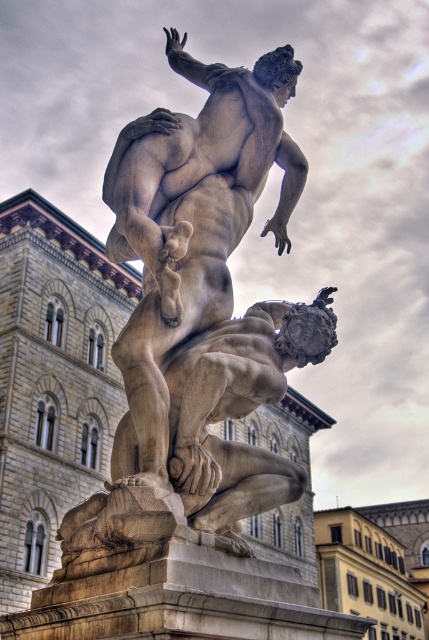
Question: Which point appears closest to the camera in this image?

Choices:
 (A) (334, 289)
 (B) (172, 256)

Answer: (B)

Question: Is white marble statue at center above smooth stone statue at center?

Choices:
 (A) no
 (B) yes

Answer: (A)

Question: Among these objects, which one is nearest to the camera?

Choices:
 (A) white marble statue at center
 (B) smooth stone statue at center

Answer: (A)

Question: Can you confirm if white marble statue at center is wider than smooth stone statue at center?

Choices:
 (A) no
 (B) yes

Answer: (A)

Question: Among these objects, which one is nearest to the camera?

Choices:
 (A) white marble statue at center
 (B) smooth stone statue at center

Answer: (A)

Question: Can you confirm if white marble statue at center is positioned above smooth stone statue at center?

Choices:
 (A) yes
 (B) no

Answer: (B)